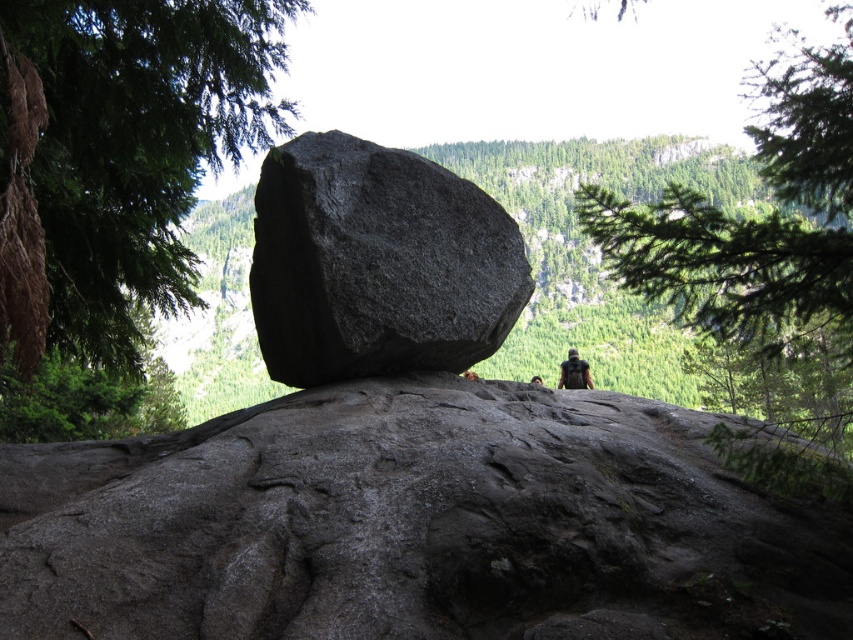
You are an artist planning to paint this scene. You want to ensure the dark gray granite boulder at center and the green leafy branch at upper right are proportionally accurate. Which object should you draw larger in your painting?

The green leafy branch at upper right should be drawn larger than the dark gray granite boulder at center because the description states that the dark gray granite boulder at center is smaller than the green leafy branch at upper right.

You are a hiker who wants to take a photo of the green leafy tree at upper left and dark green fabric backpack at center. Which object should you zoom in on to capture both in the frame without moving your camera?

The dark green fabric backpack at center is shorter than the green leafy tree at upper left. To capture both in the frame without moving the camera, you should zoom in on the dark green fabric backpack at center since it is closer and smaller in height compared to the tree.

You are a hiker who wants to take a photo of the dark green fabric backpack at center without the green leafy tree at upper left blocking the view. Which direction should you move to achieve this?

The green leafy tree at upper left is positioned over the dark green fabric backpack at center. To avoid the tree blocking the view of the backpack, you should move to the right or lower direction so that the tree is no longer in front of the backpack.